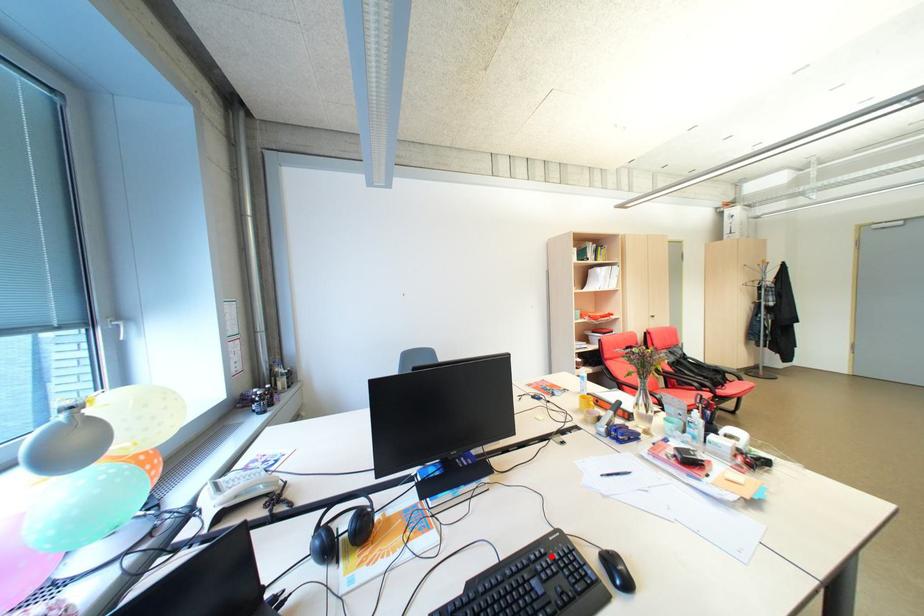
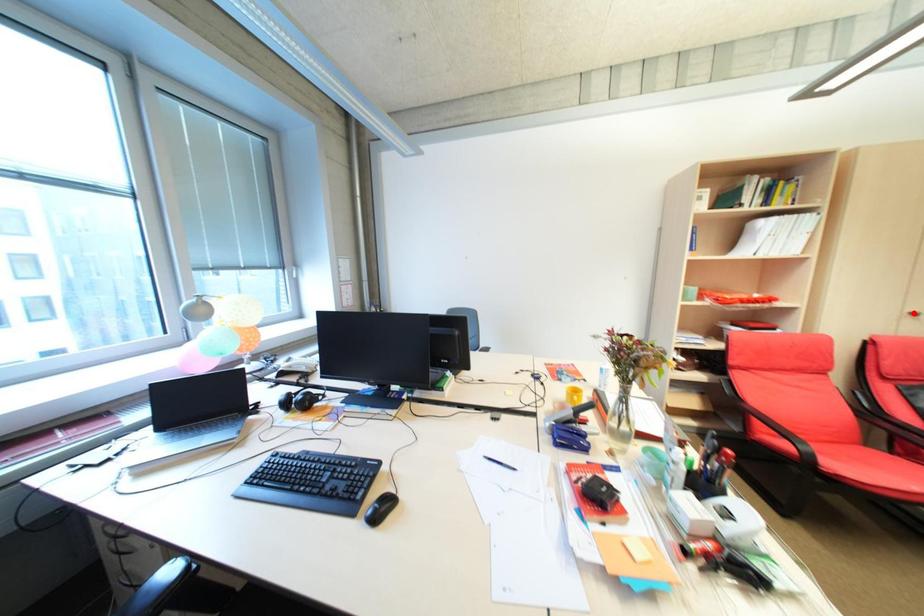
I am providing you with two images of the same scene from different viewpoints. A red point is marked on the first image and another point is marked on the second image. Does the point marked in image1 correspond to the same location as the one in image2?

No